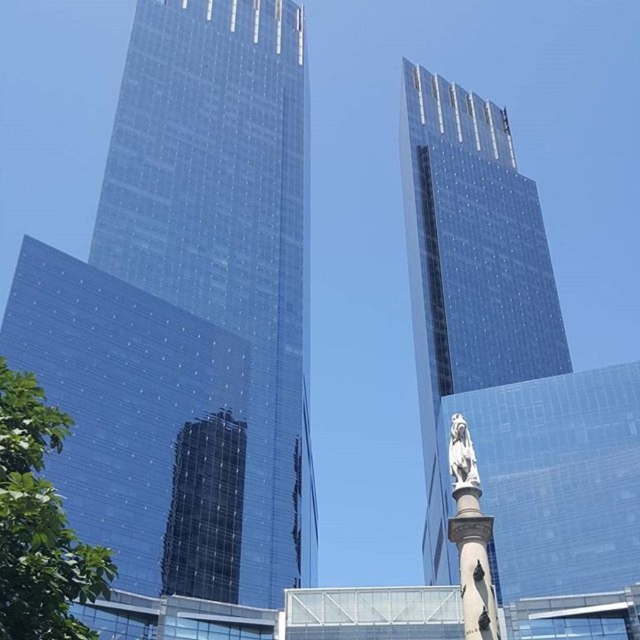
Question: Does transparent glass skyscraper at center have a smaller size compared to white marble statue at center?

Choices:
 (A) no
 (B) yes

Answer: (A)

Question: Which point is closer to the camera taking this photo?

Choices:
 (A) (467, 444)
 (B) (273, 241)
 (C) (497, 582)

Answer: (A)

Question: Does transparent glass skyscraper at center appear over white marble statue at center?

Choices:
 (A) yes
 (B) no

Answer: (A)

Question: Does transparent glass tower at left have a smaller size compared to transparent glass skyscraper at center?

Choices:
 (A) no
 (B) yes

Answer: (A)

Question: Which point is closer to the camera?

Choices:
 (A) (484, 316)
 (B) (454, 461)
 (C) (168, 202)

Answer: (B)

Question: Which point is farther to the camera?

Choices:
 (A) transparent glass tower at left
 (B) transparent glass skyscraper at center
 (C) white marble statue at center

Answer: (B)